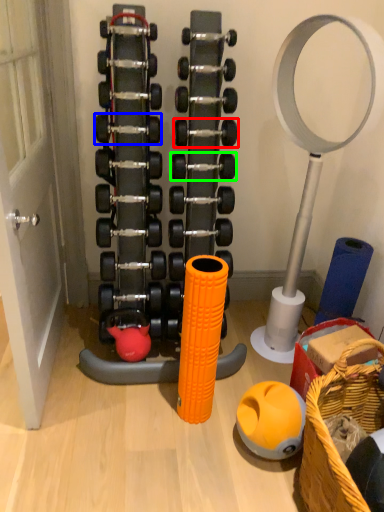
Question: Which object is positioned farthest from dumbbell (highlighted by a red box)? Select from dumbbell (highlighted by a blue box) and dumbbell (highlighted by a green box).

Choices:
 (A) dumbbell
 (B) dumbbell

Answer: (A)